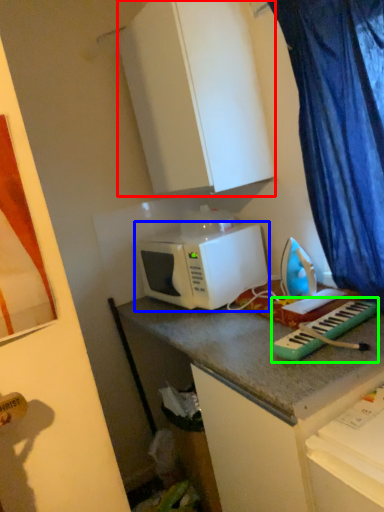
Question: Based on their relative distances, which object is nearer to cabinetry (highlighted by a red box)? Choose from microwave oven (highlighted by a blue box) and musical keyboard (highlighted by a green box).

Choices:
 (A) microwave oven
 (B) musical keyboard

Answer: (A)